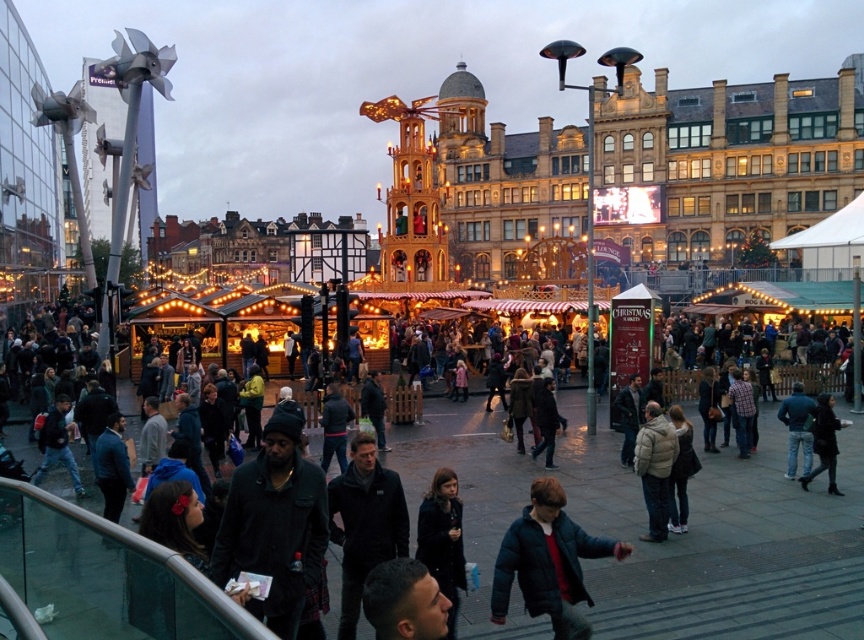
You are a photographer at the Christmas market and want to capture both the dark blue jacket at center and the dark gray jacket at center in a single shot. Which jacket will appear smaller in the photo?

The dark blue jacket at center will appear smaller in the photo because it is not as tall as the dark gray jacket at center.

You are standing at the entrance of the Christmas market and see both the dark blue jacket at center and the dark gray jacket at center. Which jacket is nearer to you?

The dark blue jacket at center is closer to the viewer than the dark gray jacket at center, so the dark blue jacket at center is nearer to you.